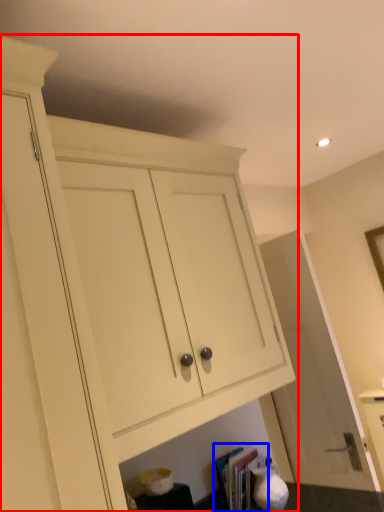
Question: Which object is further to the camera taking this photo, cabinetry (highlighted by a red box) or book (highlighted by a blue box)?

Choices:
 (A) cabinetry
 (B) book

Answer: (B)